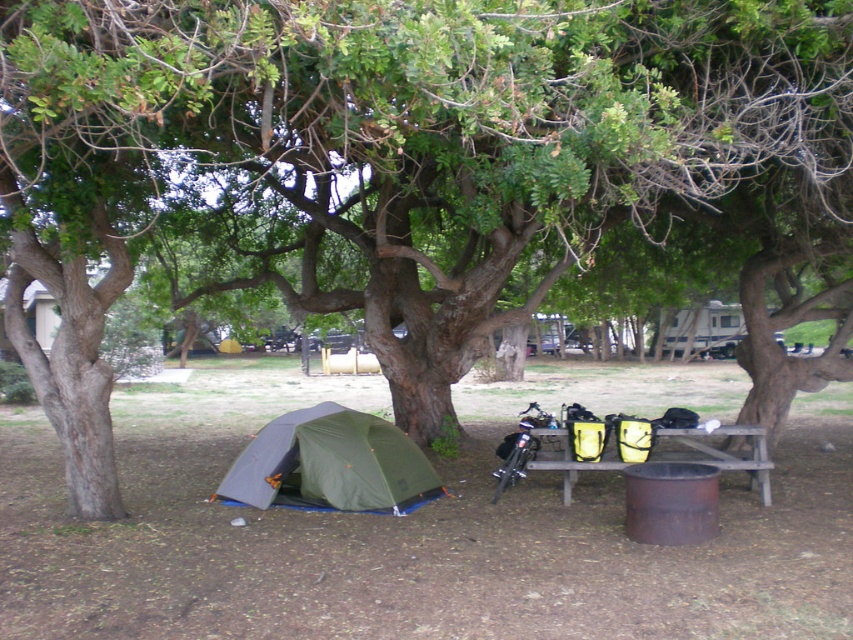
You are a camper who wants to set up a new tent. You are currently standing next to the wooden picnic table at center. Which direction should you walk to reach the green fabric tent at lower left?

You should walk to the left to reach the green fabric tent at lower left because it is located to the left of the wooden picnic table at center.